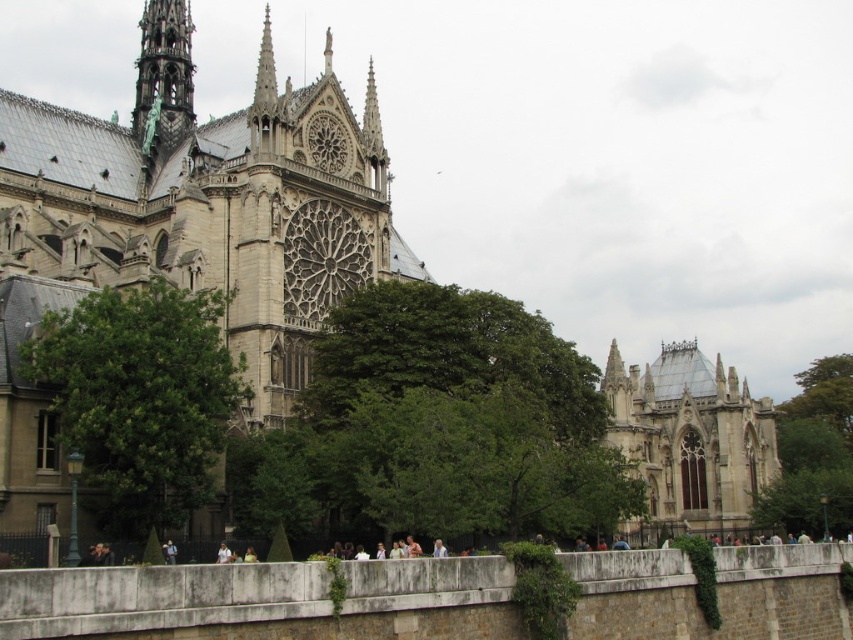
You are planning to take a photo of the cathedral with both the green leafy tree at center and the green leafy tree at left in the frame. Given that your camera has a field of view of 30 feet, will you be able to capture both trees in a single shot?

The distance between the green leafy tree at center and the green leafy tree at left is 33.80 feet. Since your camera has a field of view of 30 feet, which is shorter than the distance between them, you won